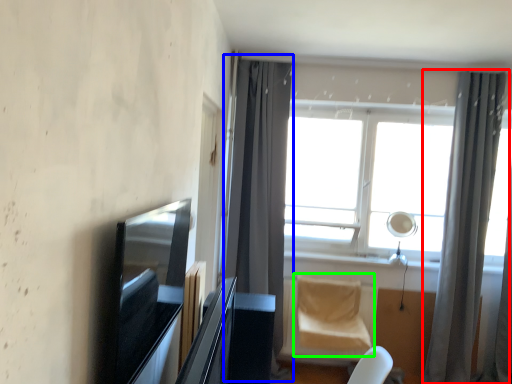
Question: Considering the real-world distances, which object is farthest from curtain (highlighted by a red box)? curtain (highlighted by a blue box) or swivel chair (highlighted by a green box)?

Choices:
 (A) curtain
 (B) swivel chair

Answer: (A)